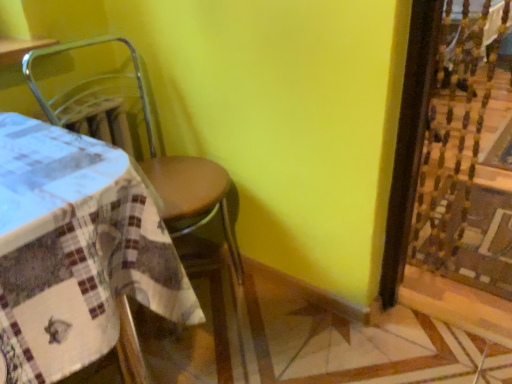
This screenshot has height=384, width=512. I want to click on unoccupied region to the right of metallic brown stool at upper left, so click(285, 328).